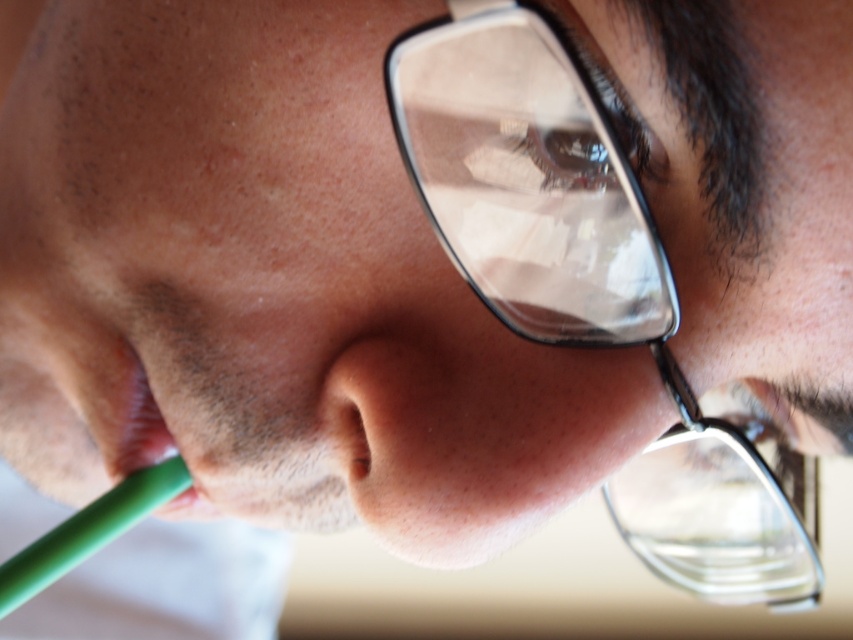
You are a photographer adjusting the focus on a camera. You notice two points in the image at coordinates point (149, 483) and point (154, 442). Which point should you focus on to ensure the subject is sharp?

Point (149, 483) is closer to the viewer than point (154, 442), so focusing on point (149, 483) will ensure the subject is sharp.

You are a dental hygienist examining a patient who has two green straws in their mouth. You need to determine which straw is closer to the patient. The straws are labeled as the green plastic straw at lower left and the green rubber straw at lower left. Which one is closer to the patient?

The green plastic straw at lower left is closer to the patient because the green rubber straw at lower left is positioned behind it.

You are a dentist examining a patient who has two straws in their mouth. The patient is holding a green plastic straw at lower left and a green rubber straw at lower left. Which one is positioned lower in the mouth?

The green plastic straw at lower left is positioned lower than the green rubber straw at lower left in the mouth.